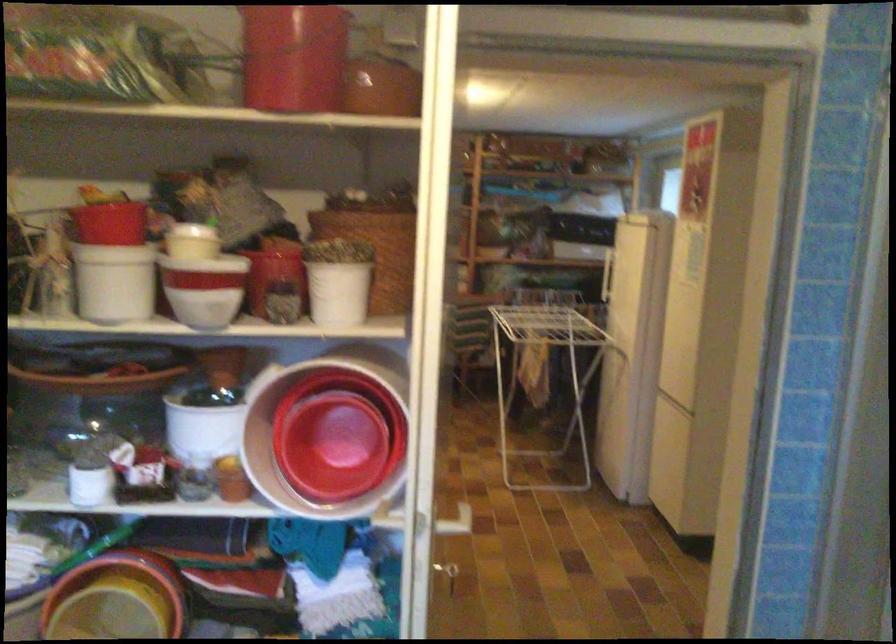
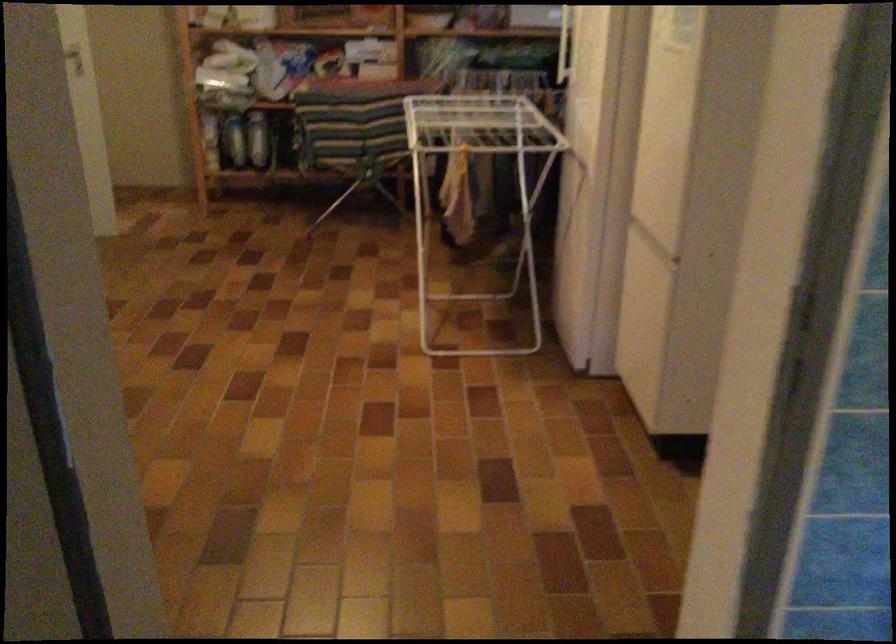
What movement of the cameraman would produce the second image?

The cameraman moved toward right, forward.